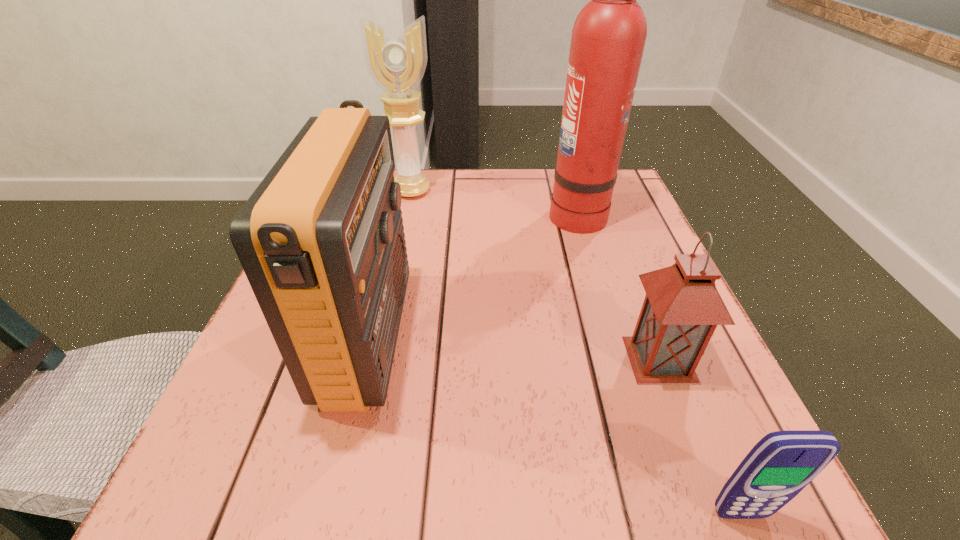
This screenshot has height=540, width=960. In order to click on vacant position located on the front-facing side of the radio receiver in this screenshot , I will do `click(510, 338)`.

This screenshot has height=540, width=960. Find the location of `free space located on the back of the lantern`. free space located on the back of the lantern is located at coordinates (607, 222).

You are a GUI agent. You are given a task and a screenshot of the screen. Output one action in this format:
    pyautogui.click(x=<x>, y=<y>)
    Task: Click on the fire extinguisher present at the far edge
    The height and width of the screenshot is (540, 960).
    Given the screenshot: What is the action you would take?
    pyautogui.click(x=608, y=37)

You are a GUI agent. You are given a task and a screenshot of the screen. Output one action in this format:
    pyautogui.click(x=<x>, y=<y>)
    Task: Click on the award located at the far edge
    
    Given the screenshot: What is the action you would take?
    pyautogui.click(x=396, y=62)

Locate an element on the screen. Image resolution: width=960 pixels, height=540 pixels. object situated at the near edge is located at coordinates (782, 463).

Identify the location of award that is at the left edge. (396, 62).

Where is `radio receiver present at the left edge`? radio receiver present at the left edge is located at coordinates (321, 240).

Locate an element on the screen. fire extinguisher situated at the right edge is located at coordinates (608, 37).

At what (x,y) coordinates should I click in order to perform the action: click on lantern at the right edge. Please return your answer as a coordinate pair (x, y). The width and height of the screenshot is (960, 540). Looking at the image, I should click on (682, 308).

Identify the location of cellular telephone situated at the right edge. The width and height of the screenshot is (960, 540). pos(782,463).